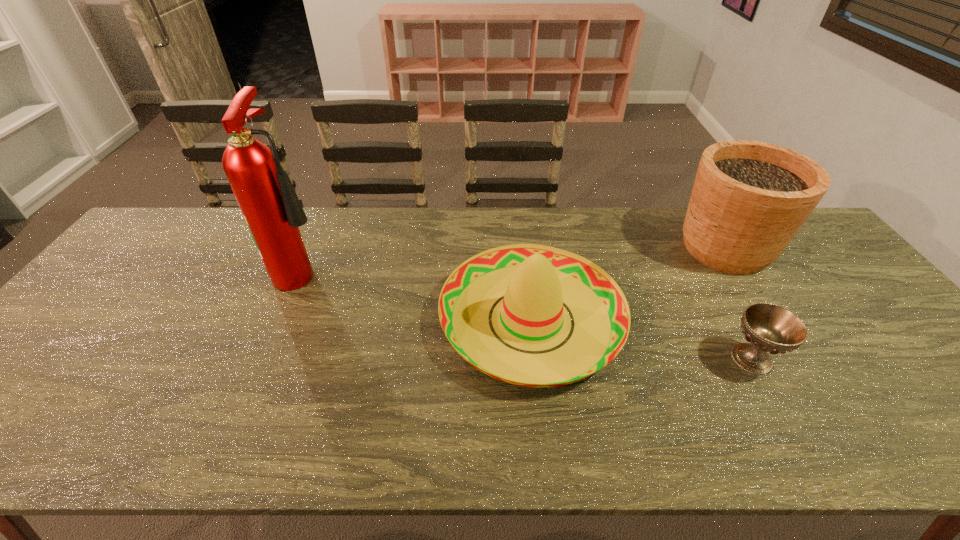
Where is `free space that satisfies the following two spatial constraints: 1. at the nozzle of the fire extinguisher; 2. on the left side of the shortest object`? This screenshot has height=540, width=960. free space that satisfies the following two spatial constraints: 1. at the nozzle of the fire extinguisher; 2. on the left side of the shortest object is located at coordinates (266, 359).

Find the location of a particular element. The height and width of the screenshot is (540, 960). vacant point that satisfies the following two spatial constraints: 1. at the nozzle of the fire extinguisher; 2. on the right side of the third object from right to left is located at coordinates (282, 319).

You are a GUI agent. You are given a task and a screenshot of the screen. Output one action in this format:
    pyautogui.click(x=<x>, y=<y>)
    Task: Click on the vacant space that satisfies the following two spatial constraints: 1. on the back side of the third object from right to left; 2. on the left side of the second tallest object
    
    Given the screenshot: What is the action you would take?
    pyautogui.click(x=523, y=247)

Identify the location of vacant space that satisfies the following two spatial constraints: 1. on the front side of the second tallest object; 2. at the nozzle of the leftmost object. This screenshot has height=540, width=960. (739, 269).

The height and width of the screenshot is (540, 960). What are the coordinates of `free location that satisfies the following two spatial constraints: 1. on the back side of the chalice; 2. at the nozzle of the leftmost object` in the screenshot? It's located at tap(703, 269).